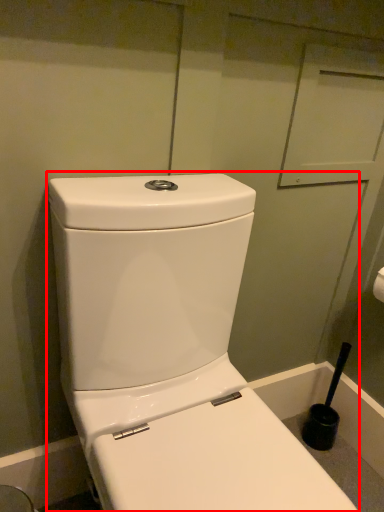
Question: From the image's perspective, where is toilet (annotated by the red box) located in relation to brush in the image?

Choices:
 (A) below
 (B) above

Answer: (B)